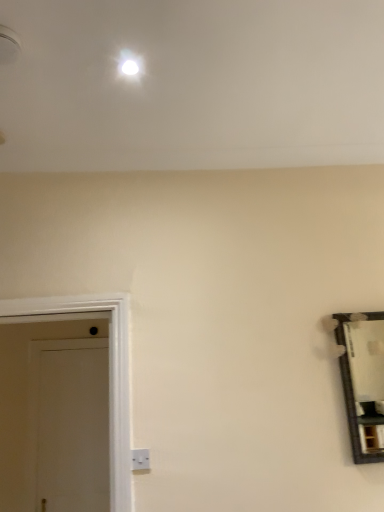
Question: In which direction should I rotate to look at white plastic electric outlet at lower center?

Choices:
 (A) right
 (B) left

Answer: (B)

Question: Is white plastic electric outlet at lower center at the left side of white matte door at left?

Choices:
 (A) no
 (B) yes

Answer: (A)

Question: From the image's perspective, is white plastic electric outlet at lower center located beneath white matte door at left?

Choices:
 (A) no
 (B) yes

Answer: (A)

Question: Is the depth of white plastic electric outlet at lower center greater than that of white matte door at left?

Choices:
 (A) yes
 (B) no

Answer: (B)

Question: Are white plastic electric outlet at lower center and white matte door at left beside each other?

Choices:
 (A) yes
 (B) no

Answer: (B)

Question: Can you confirm if white plastic electric outlet at lower center is smaller than white matte door at left?

Choices:
 (A) yes
 (B) no

Answer: (A)

Question: Is white plastic electric outlet at lower center looking in the opposite direction of white matte door at left?

Choices:
 (A) yes
 (B) no

Answer: (A)

Question: Can you confirm if white matte door at left is shorter than white plastic electric outlet at lower center?

Choices:
 (A) yes
 (B) no

Answer: (B)

Question: From the image's perspective, is white matte door at left on white plastic electric outlet at lower center?

Choices:
 (A) yes
 (B) no

Answer: (B)

Question: From a real-world perspective, does white matte door at left sit lower than white plastic electric outlet at lower center?

Choices:
 (A) no
 (B) yes

Answer: (A)

Question: Is white plastic electric outlet at lower center at the back of white matte door at left?

Choices:
 (A) yes
 (B) no

Answer: (B)

Question: Does white matte door at left have a larger size compared to white plastic electric outlet at lower center?

Choices:
 (A) no
 (B) yes

Answer: (B)

Question: Considering the relative positions of white matte door at left and white plastic electric outlet at lower center in the image provided, is white matte door at left behind white plastic electric outlet at lower center?

Choices:
 (A) yes
 (B) no

Answer: (A)

Question: Considering their positions, is white plastic electric outlet at lower center located in front of or behind white matte door at left?

Choices:
 (A) front
 (B) behind

Answer: (A)